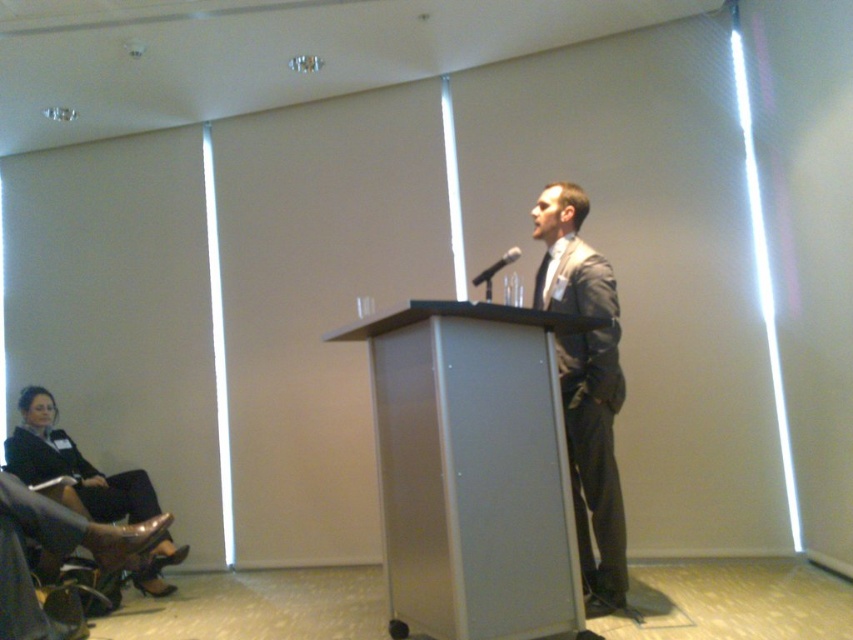
Is the position of silver metallic podium at center less distant than that of black matte microphone at center?

Yes, silver metallic podium at center is in front of black matte microphone at center.

Can you confirm if silver metallic podium at center is smaller than black matte microphone at center?

No, silver metallic podium at center is not smaller than black matte microphone at center.

Locate an element on the screen. silver metallic podium at center is located at coordinates (473, 470).

Is silver metallic podium at center taller than matte gray suit at center?

Incorrect, silver metallic podium at center's height is not larger of matte gray suit at center's.

Is silver metallic podium at center smaller than matte gray suit at center?

Actually, silver metallic podium at center might be larger than matte gray suit at center.

The width and height of the screenshot is (853, 640). What are the coordinates of `silver metallic podium at center` in the screenshot? It's located at click(473, 470).

Can you confirm if matte gray suit at center is smaller than black matte microphone at center?

No.

Is matte gray suit at center below black matte microphone at center?

Yes, matte gray suit at center is below black matte microphone at center.

Find the location of a particular element. The image size is (853, 640). matte gray suit at center is located at coordinates (585, 387).

Locate an element on the screen. The image size is (853, 640). matte gray suit at center is located at coordinates (585, 387).